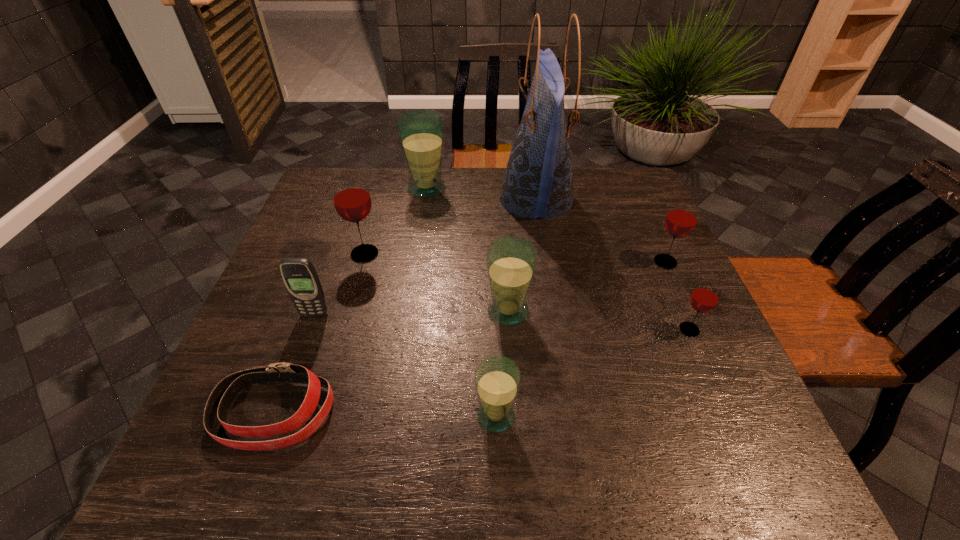
Find the location of a particular element. The height and width of the screenshot is (540, 960). vacant point located between the second farthest blue glass and the gray cellular telephone is located at coordinates (411, 313).

I want to click on unoccupied area between the cellular telephone and the biggest red glass, so click(340, 285).

Locate which object ranks second in proximity to the second farthest blue glass. Please provide its 2D coordinates. Your answer should be formatted as a tuple, i.e. [(x, y)], where the tuple contains the x and y coordinates of a point satisfying the conditions above.

[(538, 182)]

Select which object appears as the closest to the nearest blue glass. Please provide its 2D coordinates. Your answer should be formatted as a tuple, i.e. [(x, y)], where the tuple contains the x and y coordinates of a point satisfying the conditions above.

[(511, 261)]

Where is `glass that is the closest to the second nearest blue glass`? The height and width of the screenshot is (540, 960). glass that is the closest to the second nearest blue glass is located at coordinates (497, 378).

At what (x,y) coordinates should I click in order to perform the action: click on the second closest glass to the smallest blue glass. Please return your answer as a coordinate pair (x, y). Looking at the image, I should click on pos(705,297).

What are the coordinates of `red glass that stands as the second closest to the blue shopping bag` in the screenshot? It's located at (352, 201).

Locate an element on the screen. red glass that is the second closest to the nearest blue glass is located at coordinates (352, 201).

At what (x,y) coordinates should I click in order to perform the action: click on the third closest blue glass to the nearest red glass. Please return your answer as a coordinate pair (x, y). Image resolution: width=960 pixels, height=540 pixels. Looking at the image, I should click on (421, 132).

Identify the location of blue glass that is the third closest to the second smallest red glass. Image resolution: width=960 pixels, height=540 pixels. (421, 132).